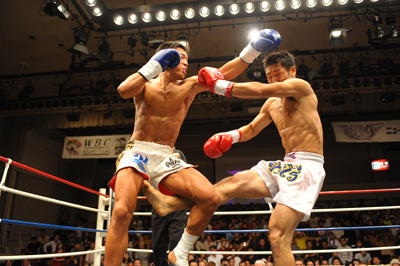
This screenshot has height=266, width=400. I want to click on ceiling, so click(49, 30).